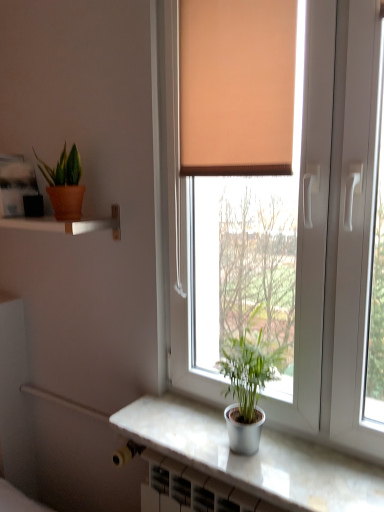
Find the location of a particular element. The height and width of the screenshot is (512, 384). vacant position to the left of silver metallic pot at window, which is counted as the 1th houseplant, starting from the front is located at coordinates (184, 444).